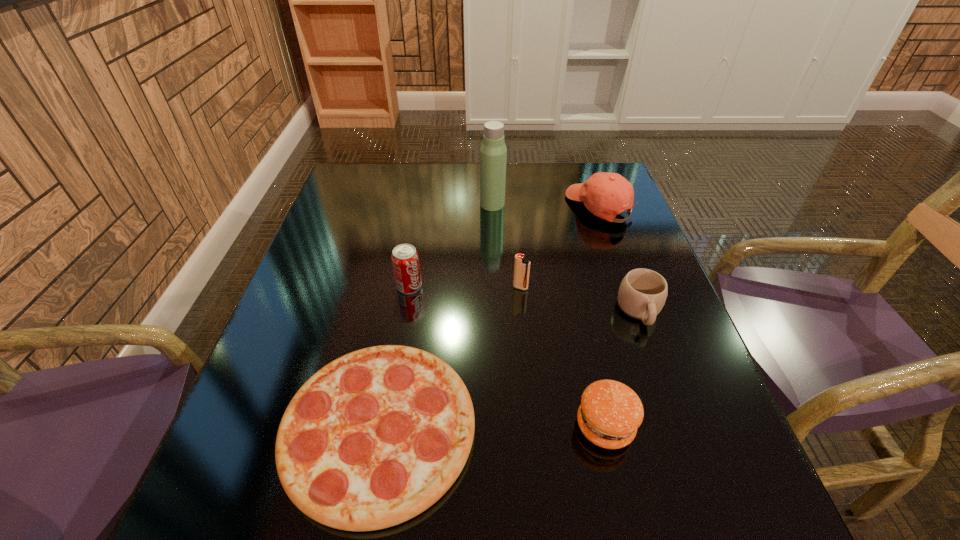
The height and width of the screenshot is (540, 960). Find the location of `patty that is positioned at the right edge`. patty that is positioned at the right edge is located at coordinates (610, 412).

Where is `mug present at the right edge`? mug present at the right edge is located at coordinates (642, 293).

Identify the location of object present at the near left corner. (374, 438).

This screenshot has width=960, height=540. I want to click on object present at the far right corner, so click(x=604, y=194).

In the image, there is a desktop. Identify the location of vacant area at the far edge. The height and width of the screenshot is (540, 960). (439, 190).

Where is `free space at the near edge of the desktop`? free space at the near edge of the desktop is located at coordinates (516, 509).

Locate an element on the screen. vacant space at the left edge of the desktop is located at coordinates (324, 228).

Where is `free space at the right edge of the desktop`? free space at the right edge of the desktop is located at coordinates (594, 245).

In order to click on vacant space at the far left corner of the desktop in this screenshot , I will do `click(374, 202)`.

I want to click on empty space that is in between the baseball cap and the pizza, so click(x=490, y=318).